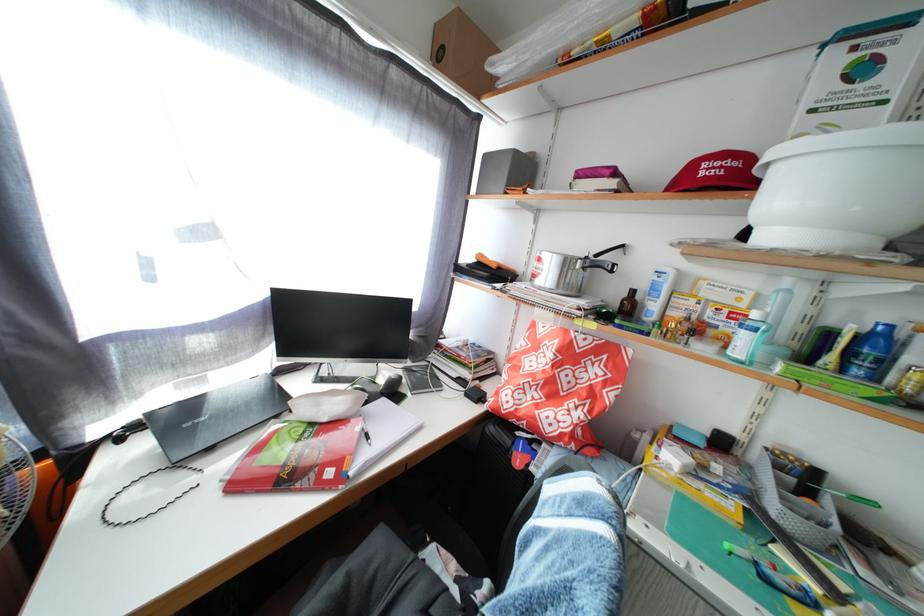
Where would you lift the clear plastic bottle? Please return your answer as a coordinate pair (x, y).

(869, 352)